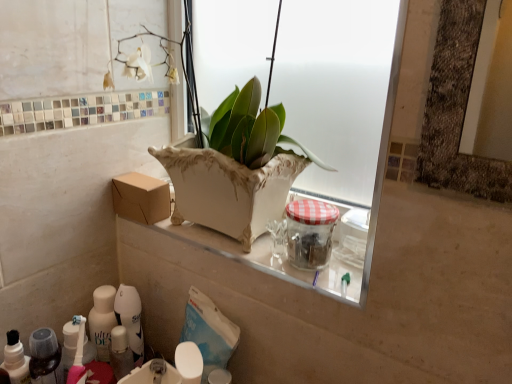
Question: Considering the positions of white glossy sink at lower center and white glossy toothpaste tube at lower left in the image, is white glossy sink at lower center bigger or smaller than white glossy toothpaste tube at lower left?

Choices:
 (A) small
 (B) big

Answer: (B)

Question: Does point (153, 370) appear closer or farther from the camera than point (27, 360)?

Choices:
 (A) closer
 (B) farther

Answer: (B)

Question: Considering the real-world distances, which object is farthest from the white glossy sink at lower center?

Choices:
 (A) white glossy toothpaste tube at lower left
 (B) clear glass jar with red checkered lid at center
 (C) white ceramic vase at center
 (D) brown cardboard box at center

Answer: (C)

Question: Which of these objects is positioned farthest from the white ceramic vase at center?

Choices:
 (A) brown cardboard box at center
 (B) white glossy sink at lower center
 (C) white glossy toothpaste tube at lower left
 (D) clear glass jar with red checkered lid at center

Answer: (C)